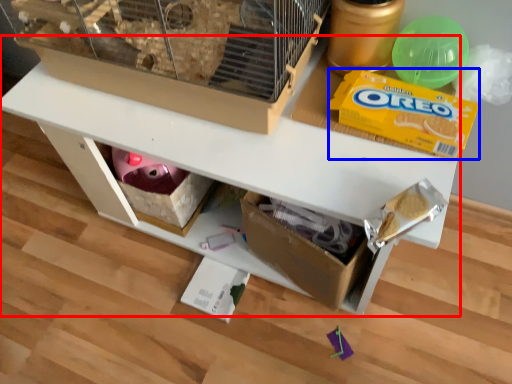
Question: Among these objects, which one is farthest to the camera, table (highlighted by a red box) or cereal (highlighted by a blue box)?

Choices:
 (A) table
 (B) cereal

Answer: (B)